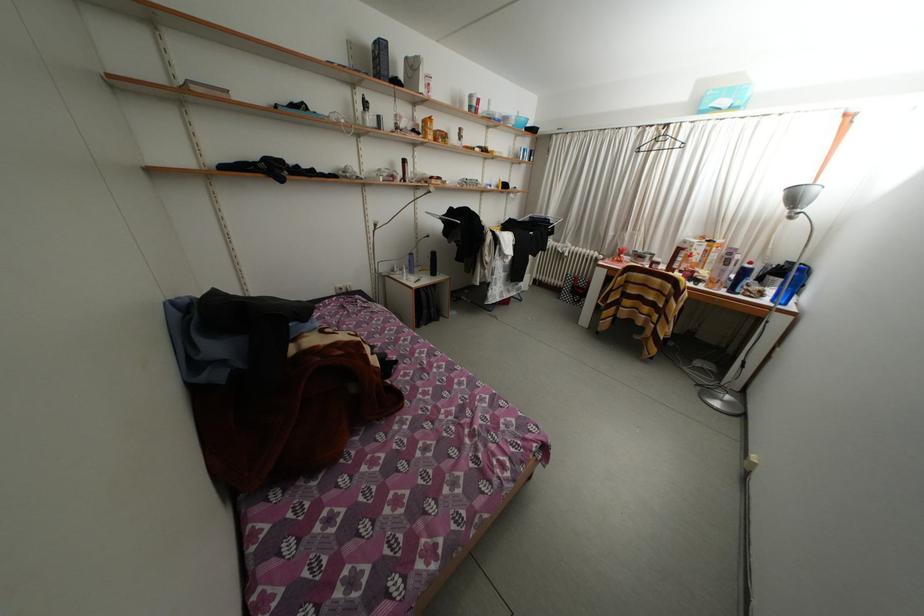
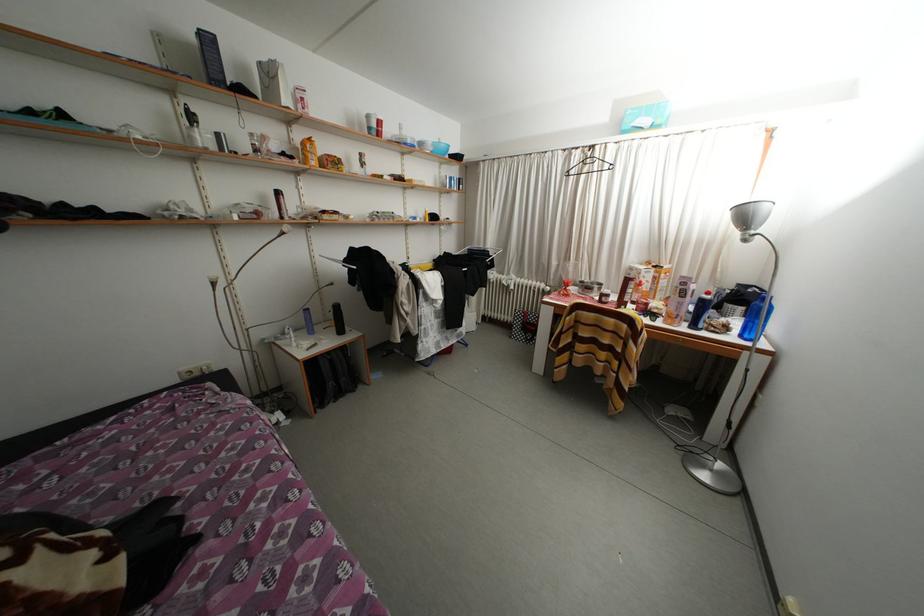
Question: The camera is either moving clockwise (left) or counter-clockwise (right) around the object. The first image is from the beginning of the video and the second image is from the end. Is the camera moving left or right when shooting the video?

Choices:
 (A) Left
 (B) Right

Answer: (A)